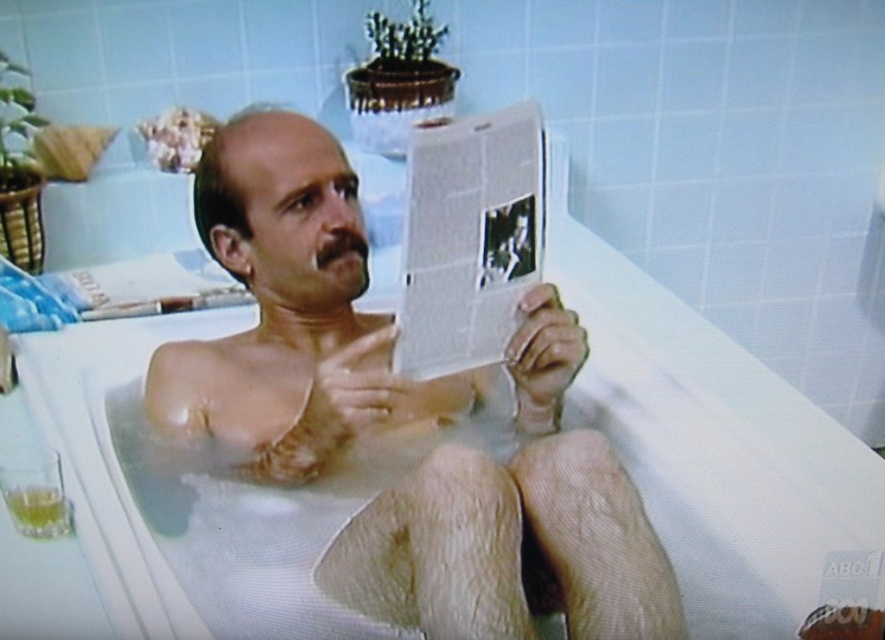
Based on the photo, does smooth skin man at center appear on the left side of white glossy newspaper at center?

Indeed, smooth skin man at center is positioned on the left side of white glossy newspaper at center.

Is smooth skin man at center to the right of white glossy newspaper at center from the viewer's perspective?

Incorrect, smooth skin man at center is not on the right side of white glossy newspaper at center.

Image resolution: width=885 pixels, height=640 pixels. I want to click on smooth skin man at center, so click(293, 317).